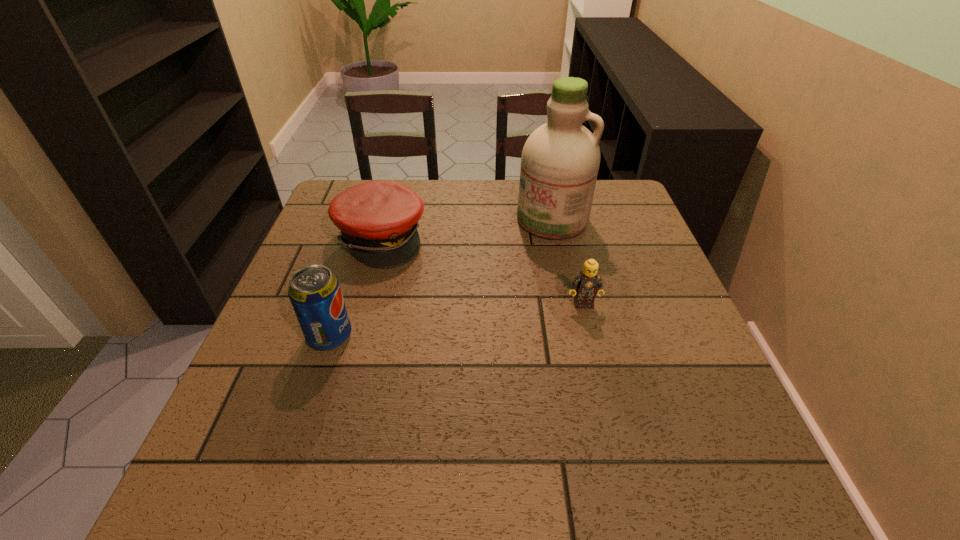
Identify the location of empty location between the Lego and the cleansing agent. (567, 262).

Identify the location of vacant area between the cleansing agent and the cap. (467, 229).

Image resolution: width=960 pixels, height=540 pixels. What are the coordinates of `vacant point located between the third farthest object and the cap` in the screenshot? It's located at (482, 271).

Locate an element on the screen. Image resolution: width=960 pixels, height=540 pixels. empty location between the cleansing agent and the second tallest object is located at coordinates (441, 278).

Image resolution: width=960 pixels, height=540 pixels. Find the location of `blank region between the third shortest object and the cap`. blank region between the third shortest object and the cap is located at coordinates (355, 287).

What are the coordinates of `vacant area that lies between the cap and the cleansing agent` in the screenshot? It's located at (467, 229).

Identify the location of the second closest object relative to the Lego. Image resolution: width=960 pixels, height=540 pixels. (378, 219).

What are the coordinates of `object that is the nearest to the soda` in the screenshot? It's located at (378, 219).

Where is `free space that satisfies the following two spatial constraints: 1. on the back side of the cap; 2. on the right side of the third shortest object`? free space that satisfies the following two spatial constraints: 1. on the back side of the cap; 2. on the right side of the third shortest object is located at coordinates (362, 239).